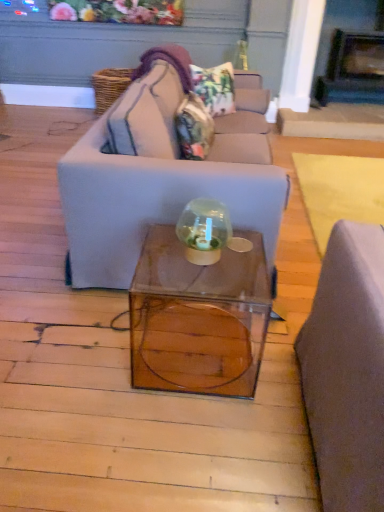
Question: From a real-world perspective, is dark gray stone fireplace at upper right above or below transparent glass cube at center?

Choices:
 (A) above
 (B) below

Answer: (A)

Question: From the image's perspective, relative to transparent glass cube at center, is dark gray stone fireplace at upper right above or below?

Choices:
 (A) above
 (B) below

Answer: (A)

Question: Which is nearer to the transparent glass cube at center?

Choices:
 (A) dark gray stone fireplace at upper right
 (B) camouflage fabric pillow at center, the 1th pillow positioned from the bottom
 (C) transparent glass globe at center
 (D) matte gray couch at center
 (E) floral fabric pillow at upper center, which ranks as the 2th pillow in bottom-to-top order

Answer: (C)

Question: Which object is positioned farthest from the matte gray couch at center?

Choices:
 (A) dark gray stone fireplace at upper right
 (B) floral fabric pillow at upper center, the first pillow positioned from the top
 (C) transparent glass cube at center
 (D) transparent glass globe at center
 (E) camouflage fabric pillow at center, the 1th pillow positioned from the bottom

Answer: (A)